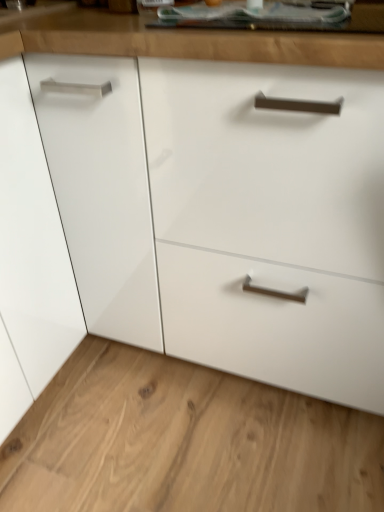
Where is `empty space that is ontop of white glossy drawer at lower right (from a real-world perspective)`? Image resolution: width=384 pixels, height=512 pixels. empty space that is ontop of white glossy drawer at lower right (from a real-world perspective) is located at coordinates (166, 421).